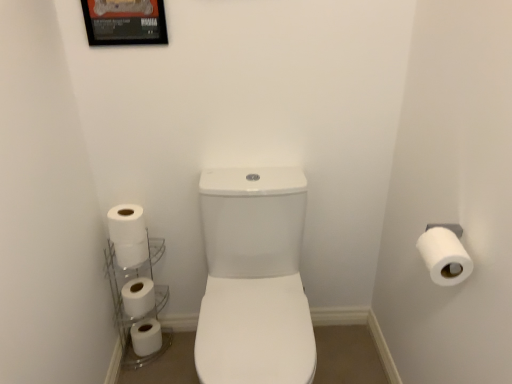
Question: From the image's perspective, is clear glass shelves at lower left over white matte toilet paper at left, which is counted as the 3th toilet paper, starting from the back?

Choices:
 (A) yes
 (B) no

Answer: (B)

Question: Does clear glass shelves at lower left have a greater width compared to white matte toilet paper at left, acting as the 3th toilet paper starting from the right?

Choices:
 (A) no
 (B) yes

Answer: (B)

Question: From a real-world perspective, is clear glass shelves at lower left physically above white matte toilet paper at left, which is counted as the 3th toilet paper, starting from the back?

Choices:
 (A) no
 (B) yes

Answer: (A)

Question: Is clear glass shelves at lower left touching white matte toilet paper at left, marked as the 3th toilet paper in a bottom-to-top arrangement?

Choices:
 (A) no
 (B) yes

Answer: (A)

Question: Considering the relative positions of clear glass shelves at lower left and white matte toilet paper at left, which is the third toilet paper from left to right, in the image provided, is clear glass shelves at lower left to the right of white matte toilet paper at left, which is the third toilet paper from left to right, from the viewer's perspective?

Choices:
 (A) yes
 (B) no

Answer: (B)

Question: From the image's perspective, does clear glass shelves at lower left appear lower than white matte toilet paper at left, marked as the 3th toilet paper in a bottom-to-top arrangement?

Choices:
 (A) no
 (B) yes

Answer: (B)

Question: Does white matte toilet paper at left, placed as the 5th toilet paper when sorted from bottom to top, touch metallic framed poster at upper left?

Choices:
 (A) no
 (B) yes

Answer: (A)

Question: Does white matte toilet paper at left, the 4th toilet paper positioned from the left, appear on the left side of metallic framed poster at upper left?

Choices:
 (A) no
 (B) yes

Answer: (B)

Question: Is white matte toilet paper at left, acting as the second toilet paper starting from the right, further to the viewer compared to metallic framed poster at upper left?

Choices:
 (A) no
 (B) yes

Answer: (B)

Question: From a real-world perspective, does white matte toilet paper at left, the 4th toilet paper from the back, stand above metallic framed poster at upper left?

Choices:
 (A) yes
 (B) no

Answer: (B)

Question: Is white matte toilet paper at left, the 4th toilet paper from the back, closer to camera compared to metallic framed poster at upper left?

Choices:
 (A) yes
 (B) no

Answer: (B)

Question: Considering the relative sizes of white matte toilet paper at left, marked as the second toilet paper in a front-to-back arrangement, and metallic framed poster at upper left in the image provided, is white matte toilet paper at left, marked as the second toilet paper in a front-to-back arrangement, bigger than metallic framed poster at upper left?

Choices:
 (A) yes
 (B) no

Answer: (A)

Question: Is clear glass shelves at lower left shorter than white matte toilet paper at right, arranged as the 5th toilet paper when viewed from the left?

Choices:
 (A) no
 (B) yes

Answer: (A)